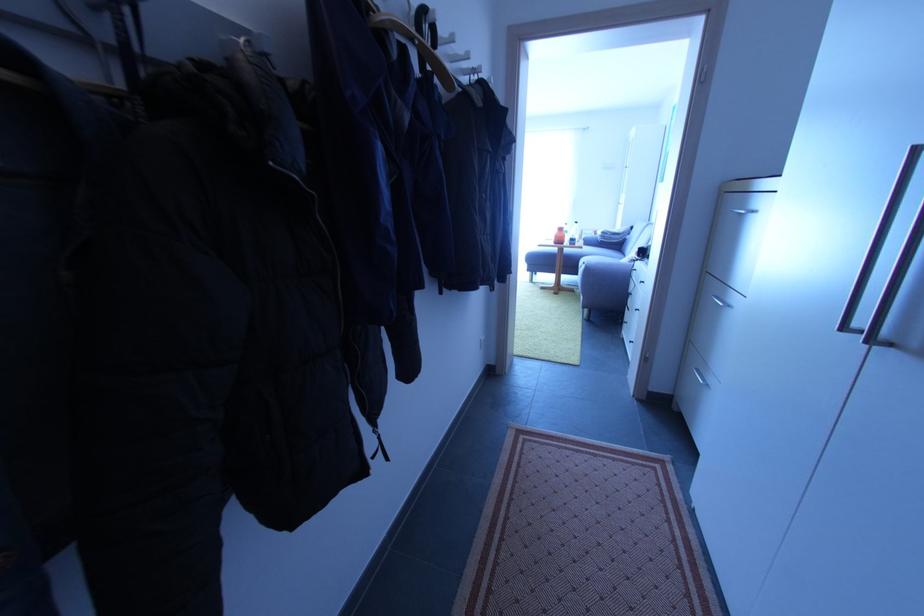
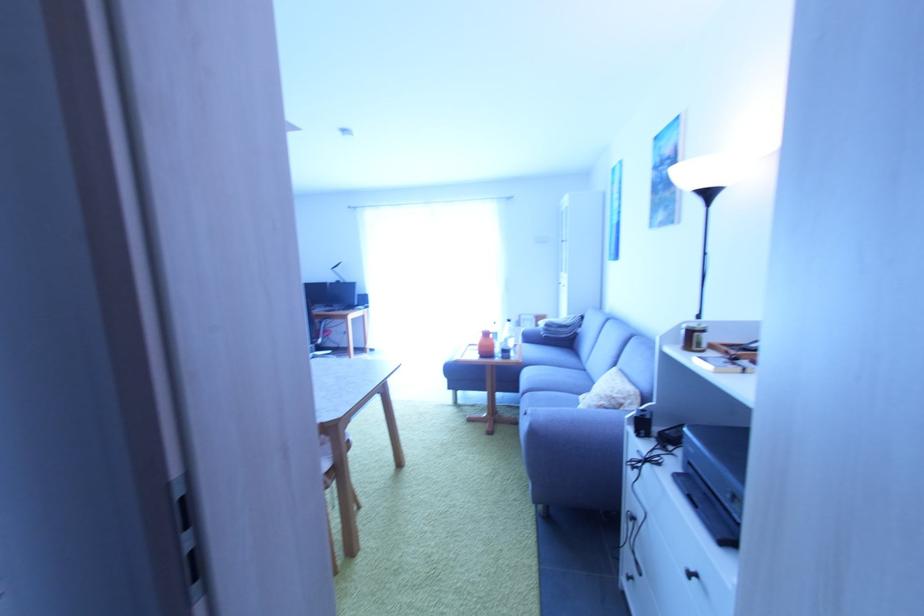
Find the pixel in the second image that matches (x=575, y=246) in the first image.

(507, 360)